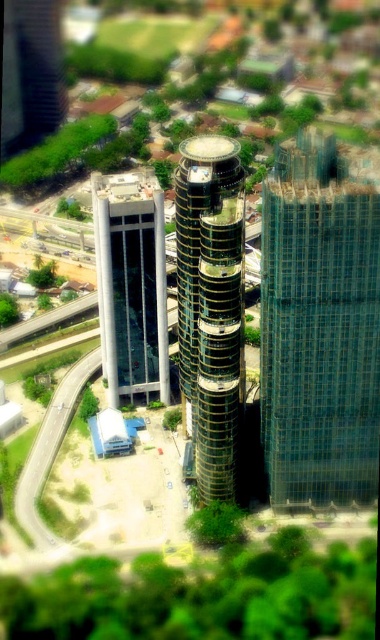
Is transparent glass tower at right above white concrete building at left?

No.

Does transparent glass tower at right have a lesser width compared to white concrete building at left?

No.

Describe the element at coordinates (319, 324) in the screenshot. I see `transparent glass tower at right` at that location.

Find the location of a particular element. This screenshot has height=640, width=380. transparent glass tower at right is located at coordinates (319, 324).

The width and height of the screenshot is (380, 640). Describe the element at coordinates (210, 310) in the screenshot. I see `glassy black tower at center` at that location.

Between point (204, 140) and point (114, 401), which one is positioned in front?

Point (204, 140)

Where is `glassy black tower at center`? This screenshot has height=640, width=380. glassy black tower at center is located at coordinates (210, 310).

Can you confirm if transparent glass tower at right is bigger than glassy black tower at center?

Yes, transparent glass tower at right is bigger than glassy black tower at center.

Who is more forward, (x=286, y=316) or (x=242, y=333)?

Point (x=286, y=316) is more forward.

This screenshot has width=380, height=640. What are the coordinates of `transparent glass tower at right` in the screenshot? It's located at (319, 324).